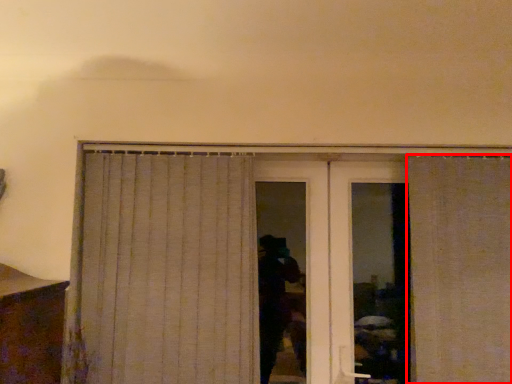
Question: Observing the image, what is the correct spatial positioning of curtain (annotated by the red box) in reference to curtain?

Choices:
 (A) left
 (B) right

Answer: (B)